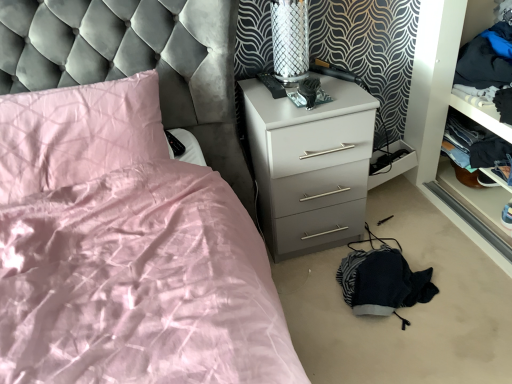
Question: Is dark blue fabric at right, which ranks as the 1th clothing in bottom-to-top order, in front of or behind dark blue fabric at right, which ranks as the first clothing in top-to-bottom order, in the image?

Choices:
 (A) front
 (B) behind

Answer: (B)

Question: In terms of size, does dark blue fabric at right, which ranks as the 1th clothing in bottom-to-top order, appear bigger or smaller than dark blue fabric at right, which ranks as the first clothing in top-to-bottom order?

Choices:
 (A) small
 (B) big

Answer: (A)

Question: Which object is positioned closest to the white glossy chest of drawers at center?

Choices:
 (A) metallic mesh table lamp at upper right
 (B) dark blue fabric at right, which is the 2th clothing in bottom-to-top order
 (C) dark blue fabric at right, which is the second clothing from top to bottom
 (D) pink satin pillow at upper left

Answer: (A)

Question: Considering the real-world distances, which object is closest to the dark blue fabric at right, which is the second clothing from top to bottom?

Choices:
 (A) dark blue fabric at right, which ranks as the first clothing in top-to-bottom order
 (B) metallic mesh table lamp at upper right
 (C) pink satin pillow at upper left
 (D) white glossy chest of drawers at center

Answer: (A)